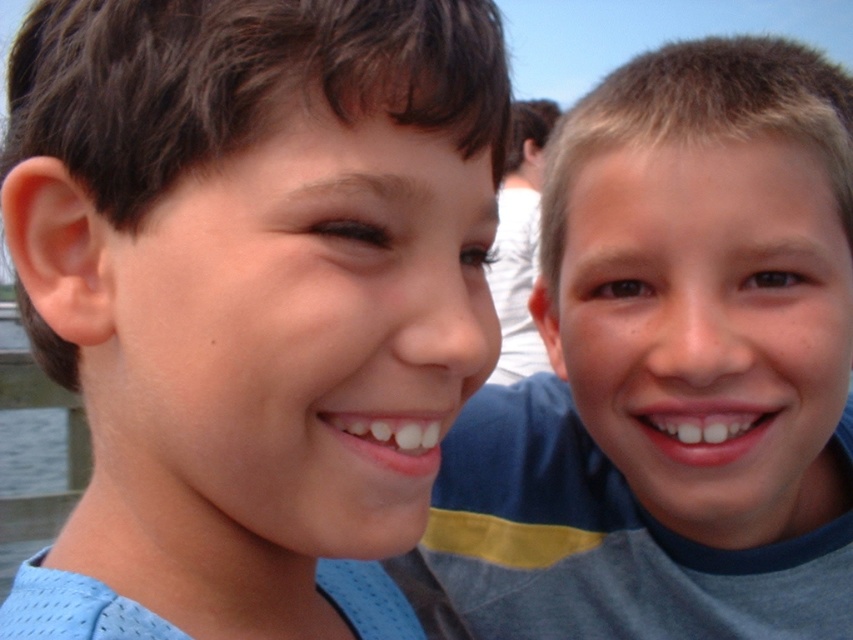
Question: Can you confirm if blue mesh shirt at left is positioned above smooth blue shirt at right?

Choices:
 (A) no
 (B) yes

Answer: (B)

Question: Does blue mesh shirt at left come in front of smooth blue shirt at right?

Choices:
 (A) no
 (B) yes

Answer: (B)

Question: Does blue mesh shirt at left have a lesser width compared to smooth blue shirt at right?

Choices:
 (A) no
 (B) yes

Answer: (B)